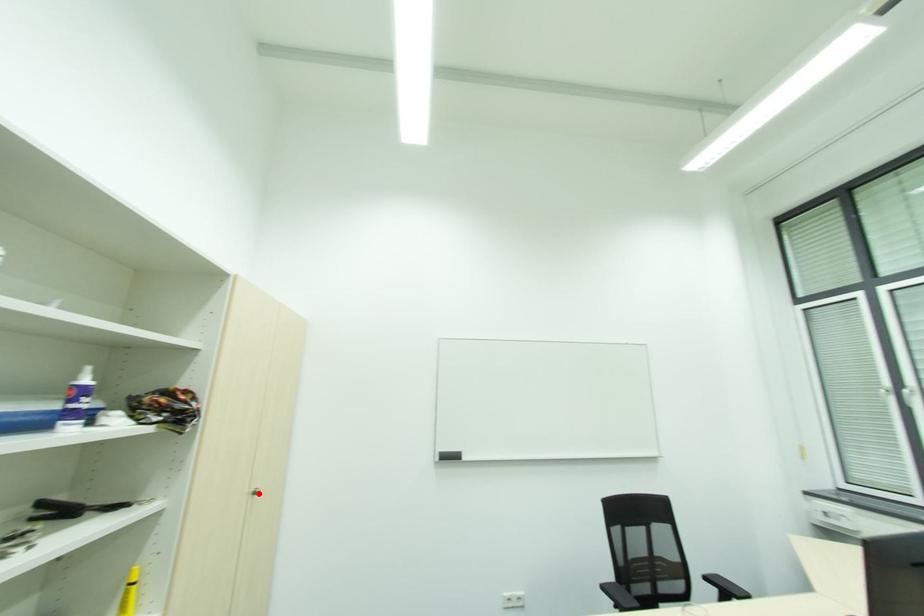
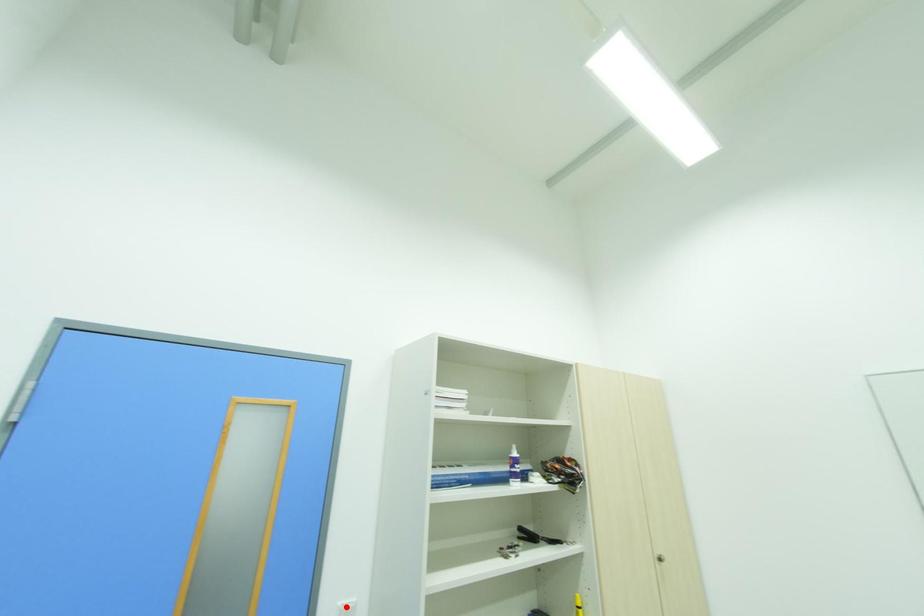
I am providing you with two images of the same scene from different viewpoints. A red point is marked on the first image and another point is marked on the second image. Are the points marked in image1 and image2 representing the same 3D position?

No